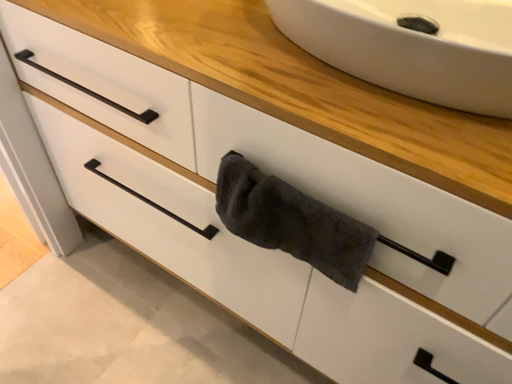
Question: Is white ceramic sink at upper center outside of dark gray terry cloth towel at center?

Choices:
 (A) yes
 (B) no

Answer: (A)

Question: From the image's perspective, is white ceramic sink at upper center beneath dark gray terry cloth towel at center?

Choices:
 (A) yes
 (B) no

Answer: (B)

Question: Is white ceramic sink at upper center turned away from dark gray terry cloth towel at center?

Choices:
 (A) no
 (B) yes

Answer: (A)

Question: Is white ceramic sink at upper center far away from dark gray terry cloth towel at center?

Choices:
 (A) no
 (B) yes

Answer: (A)

Question: Is white ceramic sink at upper center oriented towards dark gray terry cloth towel at center?

Choices:
 (A) no
 (B) yes

Answer: (A)

Question: Does white ceramic sink at upper center have a lesser width compared to dark gray terry cloth towel at center?

Choices:
 (A) no
 (B) yes

Answer: (A)

Question: Is dark gray terry cloth towel at center in front of white ceramic sink at upper center?

Choices:
 (A) yes
 (B) no

Answer: (B)

Question: Is dark gray terry cloth towel at center turned away from white ceramic sink at upper center?

Choices:
 (A) yes
 (B) no

Answer: (B)

Question: From a real-world perspective, is dark gray terry cloth towel at center located higher than white ceramic sink at upper center?

Choices:
 (A) no
 (B) yes

Answer: (A)

Question: Can white ceramic sink at upper center be found inside dark gray terry cloth towel at center?

Choices:
 (A) yes
 (B) no

Answer: (B)

Question: Does dark gray terry cloth towel at center have a greater width compared to white ceramic sink at upper center?

Choices:
 (A) no
 (B) yes

Answer: (A)

Question: Is dark gray terry cloth towel at center taller than white ceramic sink at upper center?

Choices:
 (A) yes
 (B) no

Answer: (A)

Question: Considering the positions of point tap(310, 251) and point tap(355, 69), is point tap(310, 251) closer or farther from the camera than point tap(355, 69)?

Choices:
 (A) closer
 (B) farther

Answer: (B)